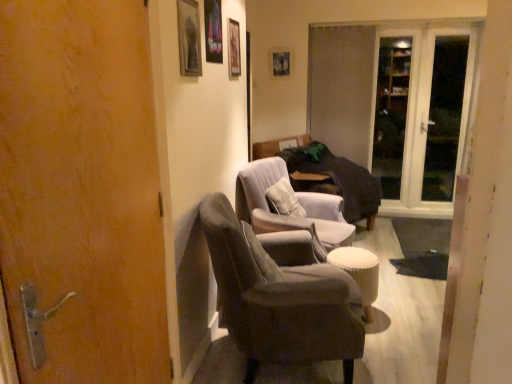
Question: Looking at their shapes, would you say wooden picture frame at upper center, the fourth picture frame in the front-to-back sequence, is wider or thinner than suede-like gray armchair at center, the 1th chair in the back-to-front sequence?

Choices:
 (A) thin
 (B) wide

Answer: (A)

Question: From a real-world perspective, is wooden picture frame at upper center, the 1th picture frame viewed from the back, positioned above or below suede-like gray armchair at center, the 1th chair in the back-to-front sequence?

Choices:
 (A) below
 (B) above

Answer: (B)

Question: Which of these objects is positioned farthest from the wooden picture frame at upper center, acting as the 4th picture frame starting from the left?

Choices:
 (A) wooden picture frame at upper center, arranged as the second picture frame when viewed from the back
 (B) transparent glass screen door at right, positioned as the first screen door in right-to-left order
 (C) white glass door at upper right
 (D) woven fabric stool at lower center
 (E) suede-like gray armchair at center, the 1th chair in the back-to-front sequence

Answer: (D)

Question: Which object is the farthest from the wooden picture frame at upper center, arranged as the second picture frame when viewed from the back?

Choices:
 (A) transparent glass screen door at right, which appears as the 2th screen door when viewed from the right
 (B) velvet grey armchair at center, which is the 1th chair in front-to-back order
 (C) woven fabric stool at lower center
 (D) wooden picture frame at upper center, the 1th picture frame viewed from the back
 (E) white glass door at upper right

Answer: (E)